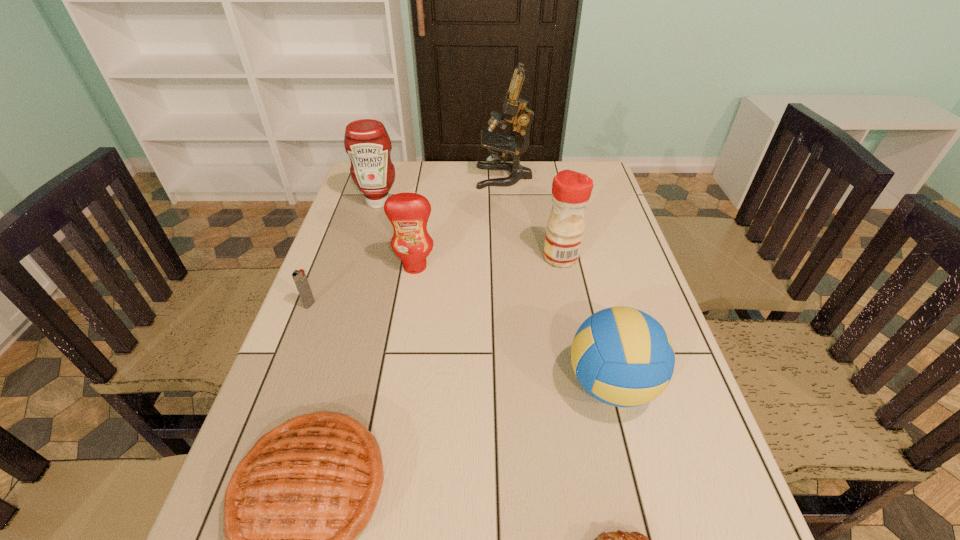
In order to click on condiment that is positioned at the right edge in this screenshot , I will do `click(571, 190)`.

Where is `volleyball present at the right edge`? Image resolution: width=960 pixels, height=540 pixels. volleyball present at the right edge is located at coordinates (623, 357).

Identify the location of object present at the far left corner. (366, 141).

The width and height of the screenshot is (960, 540). Find the location of `free space at the far edge of the desktop`. free space at the far edge of the desktop is located at coordinates (427, 163).

Where is `vacant space at the left edge`? Image resolution: width=960 pixels, height=540 pixels. vacant space at the left edge is located at coordinates (349, 203).

Find the location of a particular element. This screenshot has height=540, width=960. free space at the right edge of the desktop is located at coordinates (598, 219).

This screenshot has width=960, height=540. In order to click on free spot between the rightmost condiment and the farthest object in this screenshot , I will do `click(533, 217)`.

This screenshot has height=540, width=960. Identify the location of empty space between the rightmost condiment and the igniter. (435, 281).

This screenshot has height=540, width=960. I want to click on free space that is in between the rightmost condiment and the seventh nearest object, so click(469, 230).

This screenshot has width=960, height=540. I want to click on free area in between the igniter and the second farthest object, so click(x=344, y=253).